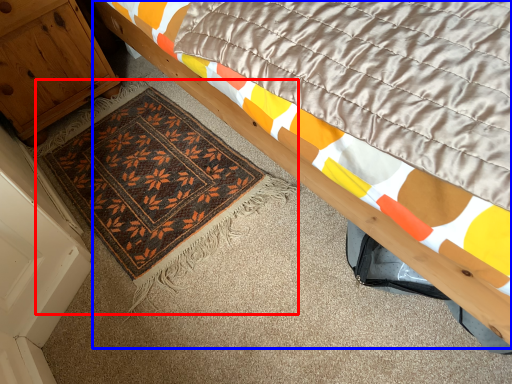
Question: Which point is further to the camera, mat (highlighted by a red box) or bed (highlighted by a blue box)?

Choices:
 (A) mat
 (B) bed

Answer: (A)